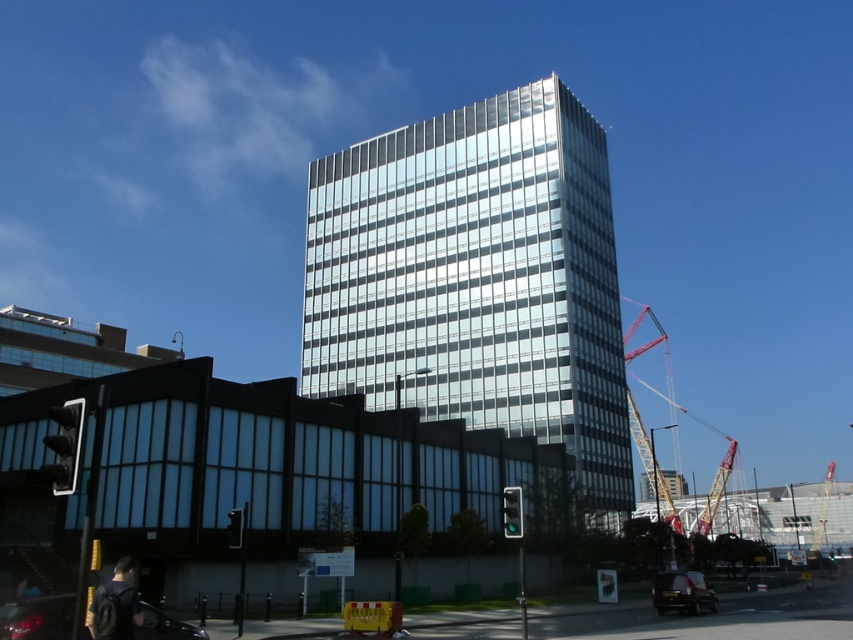
Question: Observing the image, what is the correct spatial positioning of yellow metallic crane at right in reference to shiny black car at lower right?

Choices:
 (A) left
 (B) right

Answer: (B)

Question: Which of the following is the farthest from the observer?

Choices:
 (A) (637, 353)
 (B) (39, 618)
 (C) (511, 90)

Answer: (A)

Question: Among these objects, which one is farthest from the camera?

Choices:
 (A) shiny black car at lower right
 (B) yellow metallic crane at right

Answer: (B)

Question: Which is nearer to the glassy reflective building at center?

Choices:
 (A) yellow metallic crane at right
 (B) matte black car at lower left
 (C) shiny black car at lower right

Answer: (A)

Question: Is glassy reflective building at center bigger than yellow metallic crane at right?

Choices:
 (A) yes
 (B) no

Answer: (B)

Question: Considering the relative positions of matte black car at lower left and yellow metallic crane at right in the image provided, where is matte black car at lower left located with respect to yellow metallic crane at right?

Choices:
 (A) right
 (B) left

Answer: (B)